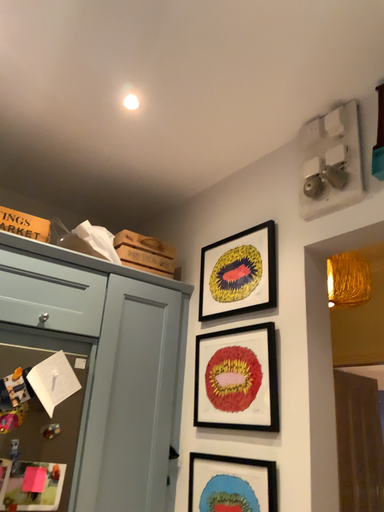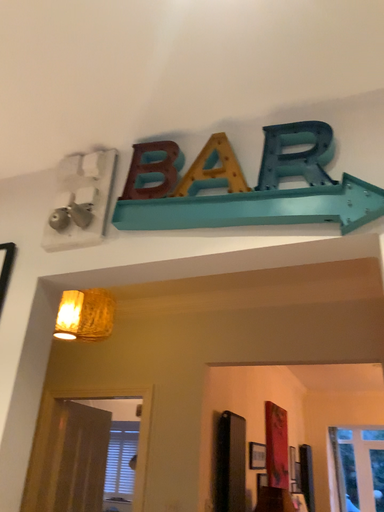
Question: How did the camera likely rotate when shooting the video?

Choices:
 (A) rotated right
 (B) rotated left

Answer: (A)